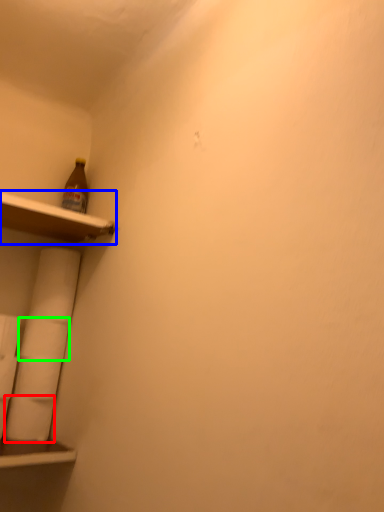
Question: Which object is the closest to the toilet paper (highlighted by a red box)? Choose among these: shelf (highlighted by a blue box) or toilet paper (highlighted by a green box).

Choices:
 (A) shelf
 (B) toilet paper

Answer: (B)